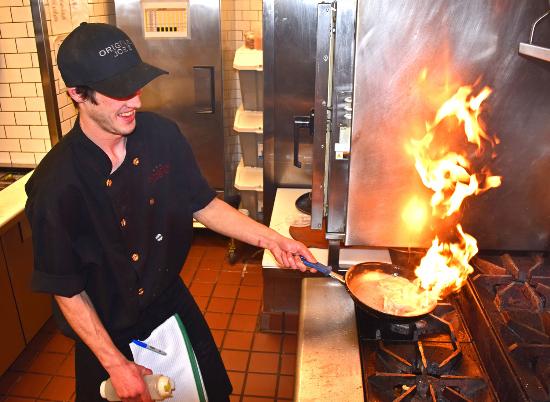
Where is `handle`? This screenshot has width=550, height=402. handle is located at coordinates (308, 125).